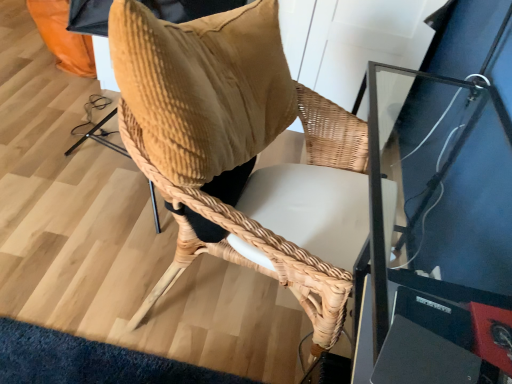
Locate an element on the screen. This screenshot has height=384, width=512. vacant space to the left of woven wood chair at center is located at coordinates (77, 281).